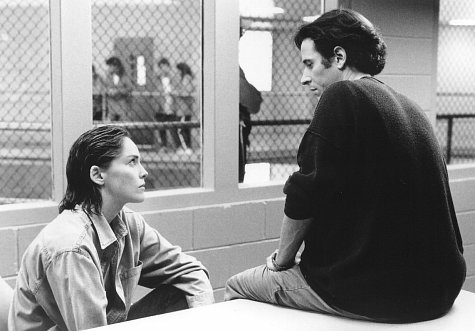
At what (x,y) coordinates should I click in order to perform the action: click on table. Please return your answer as a coordinate pair (x, y). The image size is (475, 331). Looking at the image, I should click on (266, 321).